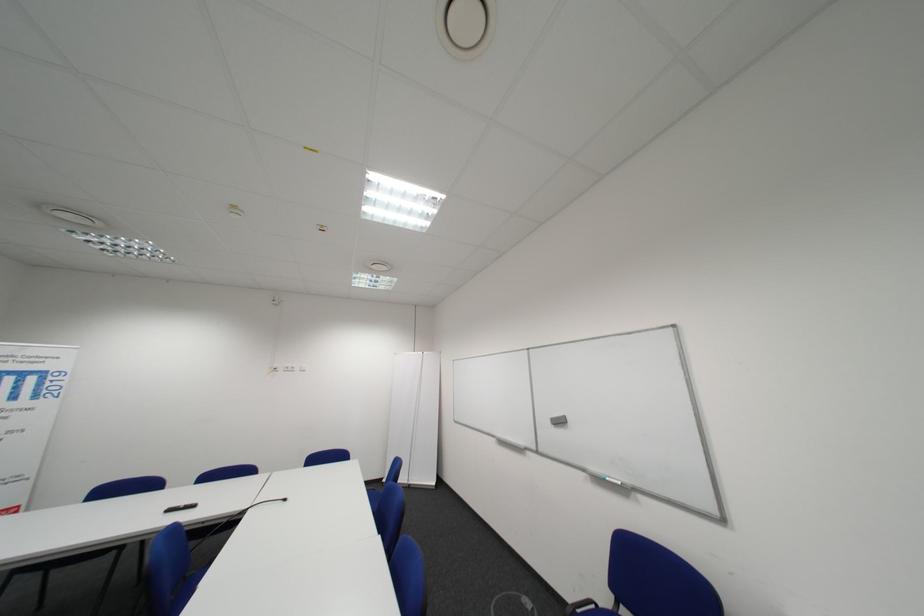
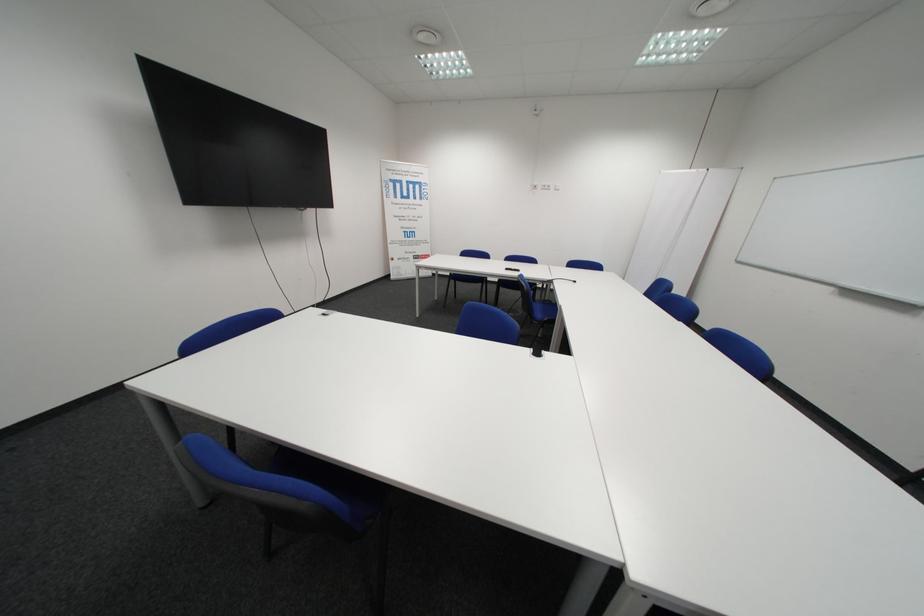
Locate, in the second image, the point that corresponds to the point at 298,371 in the first image.

(554, 188)